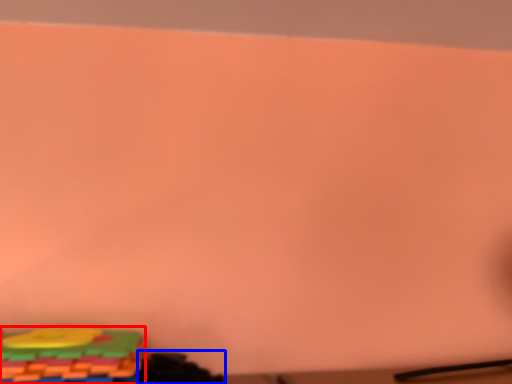
Question: Which object is further to the camera taking this photo, toy (highlighted by a red box) or toy (highlighted by a blue box)?

Choices:
 (A) toy
 (B) toy

Answer: (B)